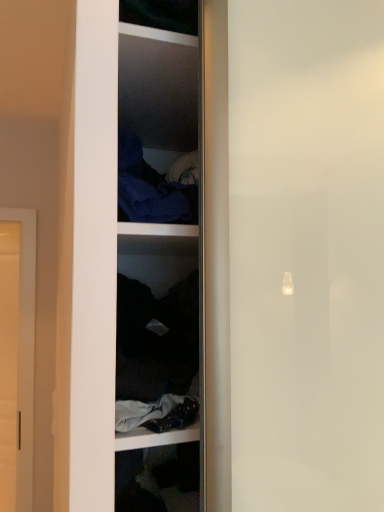
Question: Considering the relative sizes of matte white door at left and dark blue fabric at upper center in the image provided, is matte white door at left taller than dark blue fabric at upper center?

Choices:
 (A) no
 (B) yes

Answer: (B)

Question: Is matte white door at left positioned beyond the bounds of dark blue fabric at upper center?

Choices:
 (A) no
 (B) yes

Answer: (B)

Question: From the image's perspective, does matte white door at left appear lower than dark blue fabric at upper center?

Choices:
 (A) yes
 (B) no

Answer: (A)

Question: Could you tell me if matte white door at left is turned towards dark blue fabric at upper center?

Choices:
 (A) no
 (B) yes

Answer: (A)

Question: Does matte white door at left lie behind dark blue fabric at upper center?

Choices:
 (A) no
 (B) yes

Answer: (B)

Question: Can you confirm if matte white door at left is wider than dark blue fabric at upper center?

Choices:
 (A) no
 (B) yes

Answer: (A)

Question: Can you confirm if dark blue fabric at upper center is shorter than matte white door at left?

Choices:
 (A) no
 (B) yes

Answer: (B)

Question: Does dark blue fabric at upper center appear on the left side of matte white door at left?

Choices:
 (A) yes
 (B) no

Answer: (B)

Question: From a real-world perspective, is dark blue fabric at upper center located beneath matte white door at left?

Choices:
 (A) no
 (B) yes

Answer: (A)

Question: From a real-world perspective, is dark blue fabric at upper center positioned over matte white door at left based on gravity?

Choices:
 (A) yes
 (B) no

Answer: (A)

Question: Is dark blue fabric at upper center bigger than matte white door at left?

Choices:
 (A) yes
 (B) no

Answer: (B)

Question: From the image's perspective, is dark blue fabric at upper center below matte white door at left?

Choices:
 (A) yes
 (B) no

Answer: (B)

Question: Is matte white door at left not within dark fabric at center?

Choices:
 (A) no
 (B) yes

Answer: (B)